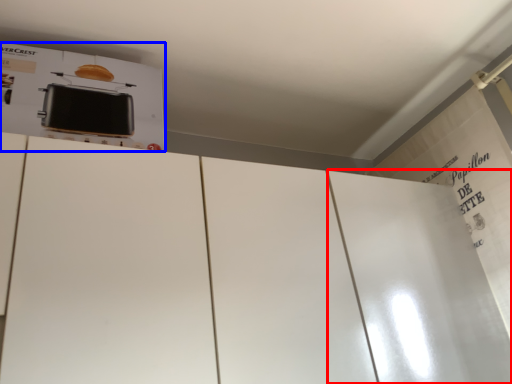
Question: Which point is closer to the camera, door (highlighted by a red box) or appliance (highlighted by a blue box)?

Choices:
 (A) door
 (B) appliance

Answer: (B)